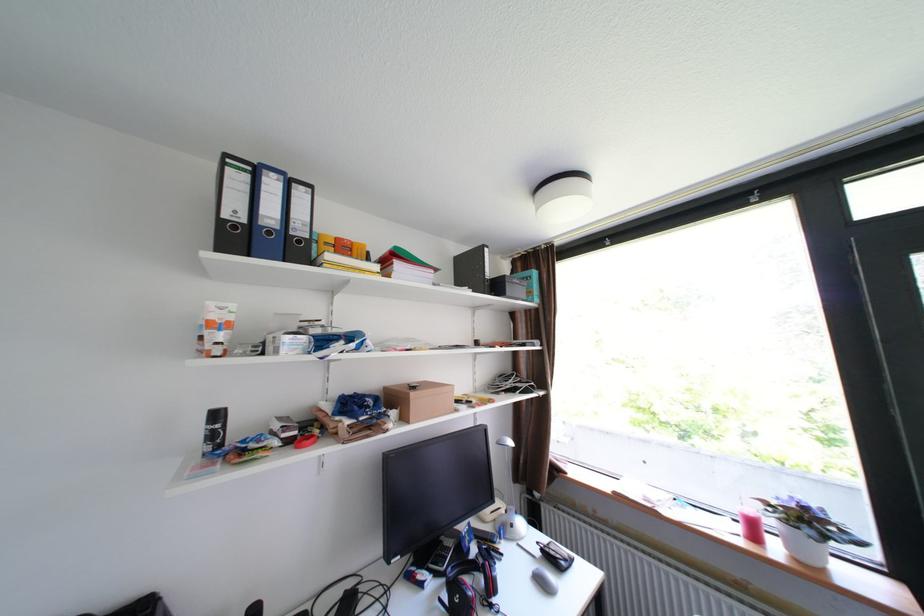
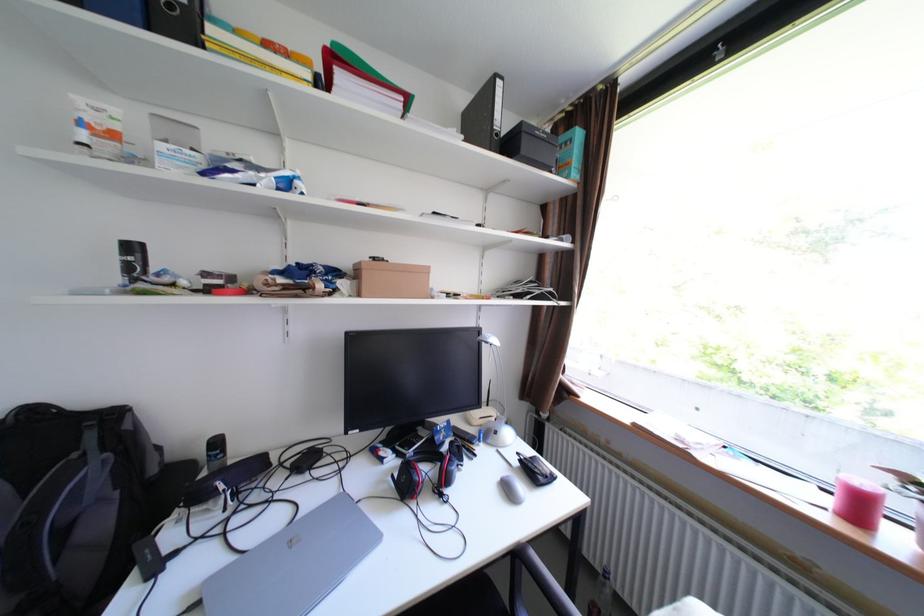
Find the pixel in the second image that matches the point at 552,583 in the first image.

(517, 490)